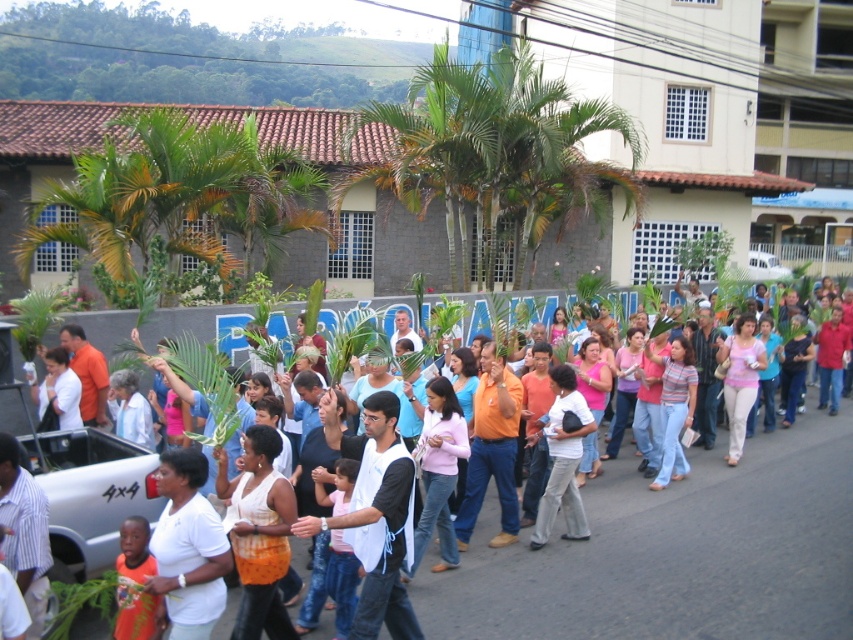
You are a photographer standing at the edge of the procession. You want to take a photo that includes both the white fabric shirt at center and the orange cotton shirt at lower left. Which shirt should you adjust your camera focus to ensure the subject in front is sharp?

The white fabric shirt at center is closer to you than the orange cotton shirt at lower left, so you should focus on the white fabric shirt at center to ensure the subject in front is sharp.

You are a photographer trying to capture a clear shot of the white fabric shirt at center. The camera is positioned at the origin point. Which direction should you move the camera to get the shirt into the frame?

Since the white fabric shirt at center is located at point 0.864 on the x and 0.792 on the y axis, you should move the camera to the right and upwards to center the shirt in the frame.

You are a photographer at the event and want to ensure both the white matte shirt at center and the orange cotton shirt at center are clearly visible in your photo. Which shirt should you focus on to avoid the shorter one being blocked by the taller one?

The white matte shirt at center is shorter than the orange cotton shirt at center, so focusing on the orange cotton shirt at center would allow the shorter white matte shirt at center to be visible without obstruction.